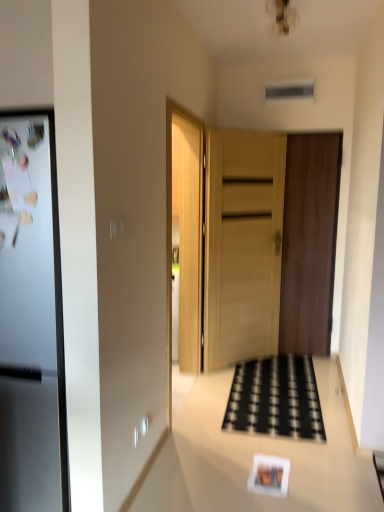
Question: From a real-world perspective, is dark brown wood door at center, the second door viewed from the left, positioned over white glossy counter top at center based on gravity?

Choices:
 (A) yes
 (B) no

Answer: (A)

Question: Is dark brown wood door at center, the 1th door from the right, looking in the opposite direction of white glossy counter top at center?

Choices:
 (A) yes
 (B) no

Answer: (B)

Question: Can you confirm if dark brown wood door at center, the 1th door from the right, is smaller than white glossy counter top at center?

Choices:
 (A) yes
 (B) no

Answer: (A)

Question: Is dark brown wood door at center, the second door viewed from the left, far away from white glossy counter top at center?

Choices:
 (A) no
 (B) yes

Answer: (B)

Question: Could you tell me if dark brown wood door at center, the second door viewed from the left, is facing white glossy counter top at center?

Choices:
 (A) yes
 (B) no

Answer: (A)

Question: Can you confirm if dark brown wood door at center, the second door viewed from the left, is thinner than white glossy counter top at center?

Choices:
 (A) yes
 (B) no

Answer: (A)

Question: Is sleek metallic fridge at left turned away from black woven mat at center?

Choices:
 (A) yes
 (B) no

Answer: (B)

Question: Is sleek metallic fridge at left to the left of black woven mat at center from the viewer's perspective?

Choices:
 (A) yes
 (B) no

Answer: (A)

Question: Is sleek metallic fridge at left positioned before black woven mat at center?

Choices:
 (A) no
 (B) yes

Answer: (B)

Question: Considering the relative sizes of sleek metallic fridge at left and black woven mat at center in the image provided, is sleek metallic fridge at left taller than black woven mat at center?

Choices:
 (A) no
 (B) yes

Answer: (B)

Question: From a real-world perspective, is sleek metallic fridge at left physically above black woven mat at center?

Choices:
 (A) yes
 (B) no

Answer: (A)

Question: Is sleek metallic fridge at left oriented towards black woven mat at center?

Choices:
 (A) yes
 (B) no

Answer: (B)

Question: Is white glossy counter top at center looking in the opposite direction of matte paper postcard at lower center?

Choices:
 (A) no
 (B) yes

Answer: (A)